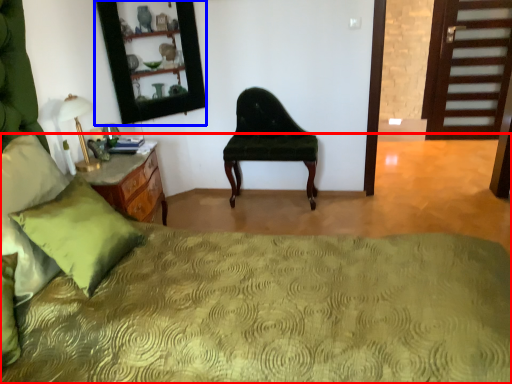
Question: Among these objects, which one is nearest to the camera, bed (highlighted by a red box) or mirror (highlighted by a blue box)?

Choices:
 (A) bed
 (B) mirror

Answer: (A)